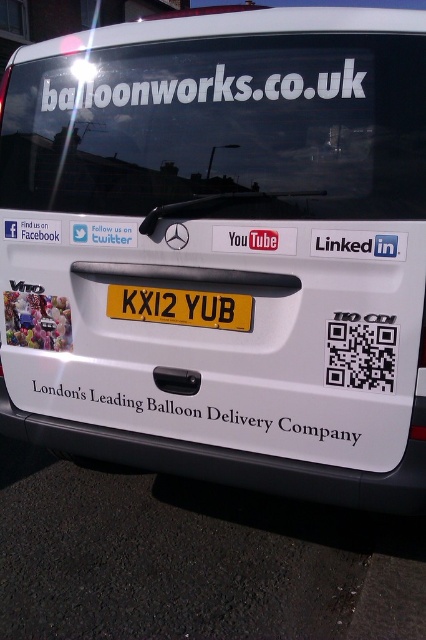
Question: Can you confirm if white matte text at center is positioned below yellow matte license plate at center?

Choices:
 (A) no
 (B) yes

Answer: (B)

Question: Does yellow matte license plate at center appear on the left side of white paper sticker at center?

Choices:
 (A) yes
 (B) no

Answer: (B)

Question: In this image, where is transparent glass windshield at upper center located relative to white paper sticker at center?

Choices:
 (A) right
 (B) left

Answer: (A)

Question: Among these points, which one is farthest from the camera?

Choices:
 (A) (339, 403)
 (B) (261, 228)
 (C) (149, 304)

Answer: (C)

Question: Among these points, which one is nearest to the camera?

Choices:
 (A) (x=279, y=248)
 (B) (x=103, y=227)

Answer: (A)

Question: Which object appears farthest from the camera in this image?

Choices:
 (A) white paper sticker at center
 (B) matte white youtube logo at center
 (C) white matte text at center
 (D) yellow matte license plate at center

Answer: (A)